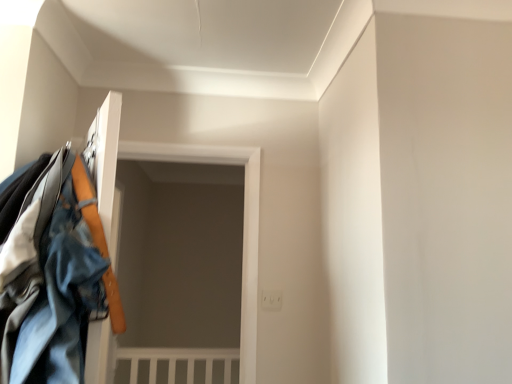
Question: Considering the relative positions of denim jacket at left and denim jacket at left in the image provided, is denim jacket at left behind denim jacket at left?

Choices:
 (A) yes
 (B) no

Answer: (A)

Question: Is denim jacket at left shorter than denim jacket at left?

Choices:
 (A) yes
 (B) no

Answer: (B)

Question: Is denim jacket at left oriented away from denim jacket at left?

Choices:
 (A) yes
 (B) no

Answer: (B)

Question: Is denim jacket at left not near denim jacket at left?

Choices:
 (A) no
 (B) yes

Answer: (A)

Question: Does denim jacket at left appear on the right side of denim jacket at left?

Choices:
 (A) no
 (B) yes

Answer: (A)

Question: From the image's perspective, is denim jacket at left on top of denim jacket at left?

Choices:
 (A) yes
 (B) no

Answer: (B)

Question: Can you confirm if denim jacket at left is thinner than denim jacket at left?

Choices:
 (A) yes
 (B) no

Answer: (B)

Question: From a real-world perspective, is denim jacket at left positioned under denim jacket at left based on gravity?

Choices:
 (A) no
 (B) yes

Answer: (B)

Question: Is denim jacket at left outside of denim jacket at left?

Choices:
 (A) no
 (B) yes

Answer: (B)

Question: Considering the relative positions of denim jacket at left and denim jacket at left in the image provided, is denim jacket at left in front of denim jacket at left?

Choices:
 (A) yes
 (B) no

Answer: (A)

Question: Can you confirm if denim jacket at left is smaller than denim jacket at left?

Choices:
 (A) yes
 (B) no

Answer: (B)

Question: Can you confirm if denim jacket at left is wider than denim jacket at left?

Choices:
 (A) yes
 (B) no

Answer: (A)

Question: Is denim jacket at left in front of or behind denim jacket at left in the image?

Choices:
 (A) behind
 (B) front

Answer: (B)